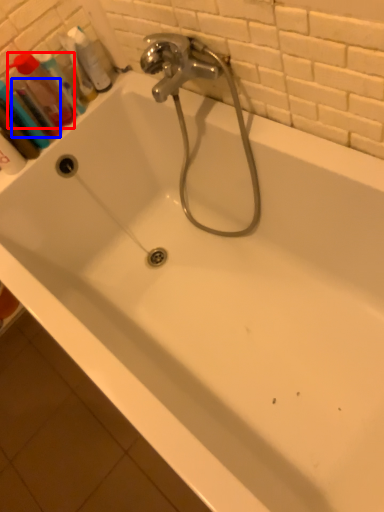
Question: Among these objects, which one is farthest to the camera, mouthwash (highlighted by a red box) or mouthwash (highlighted by a blue box)?

Choices:
 (A) mouthwash
 (B) mouthwash

Answer: (A)